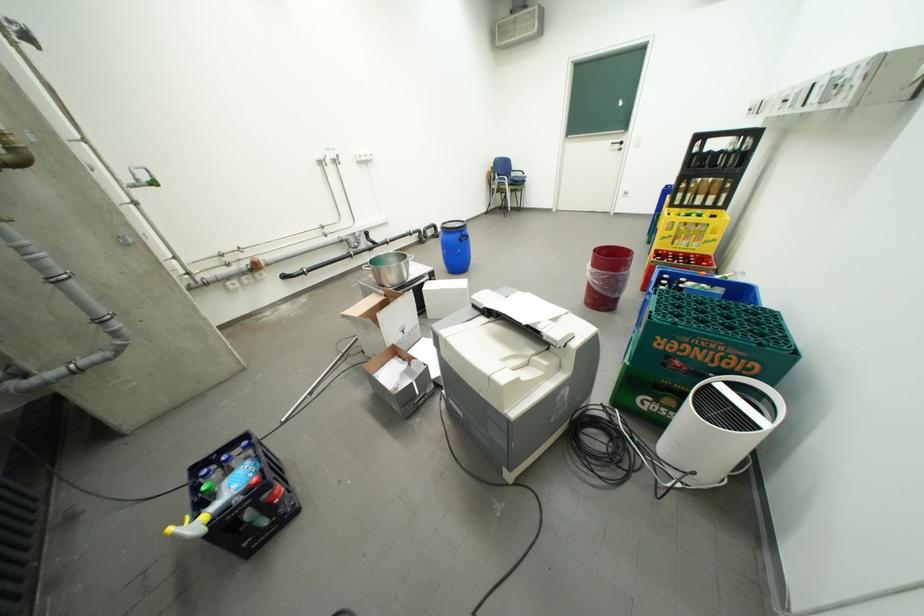
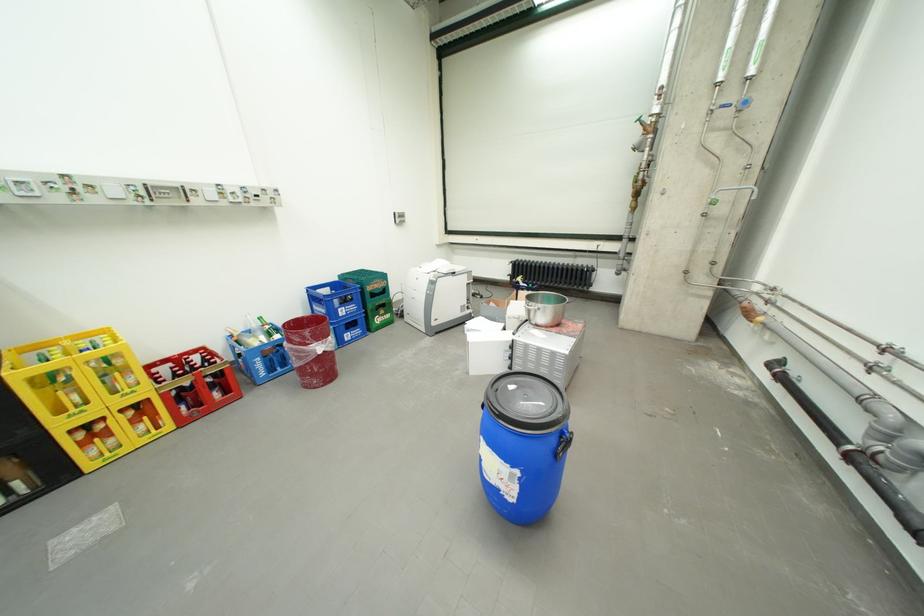
Locate, in the second image, the point that corresponds to the point at 676,211 in the first image.

(30, 374)